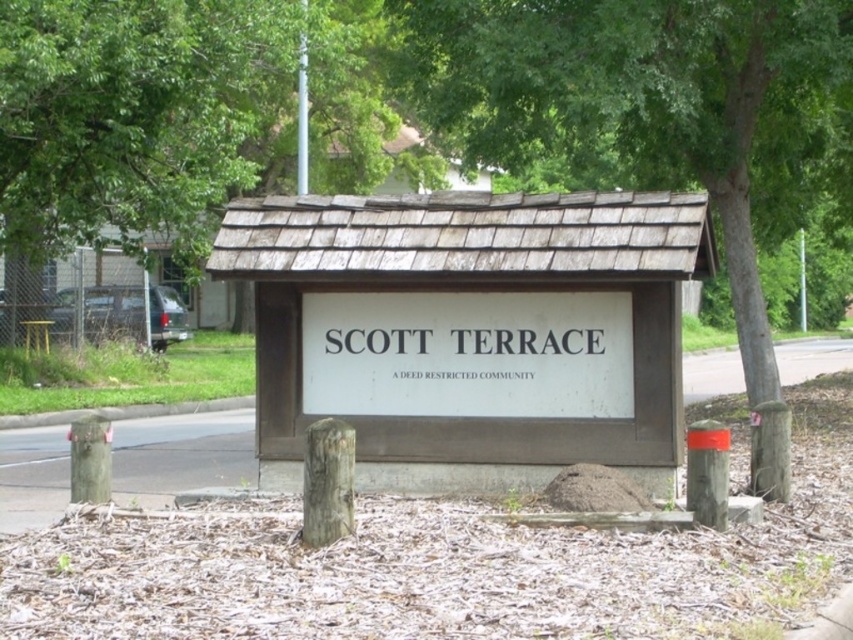
You are standing at the entrance of Scott Terrace and want to read the wooden sign at center. There is also a green leafy tree at center in your view. Which object is closer to you?

The wooden sign at center is closer to the viewer than the green leafy tree at center.